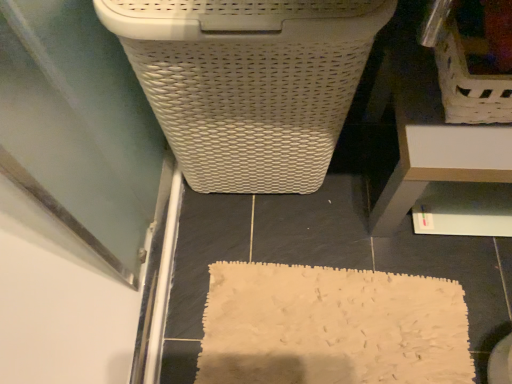
Question: Is white wicker laundry basket at upper right bigger or smaller than white plastic drawer at lower right?

Choices:
 (A) small
 (B) big

Answer: (A)

Question: From the image's perspective, is white wicker laundry basket at upper right located above or below white plastic drawer at lower right?

Choices:
 (A) below
 (B) above

Answer: (B)

Question: Considering the real-world distances, which object is closest to the white woven laundry basket at upper center?

Choices:
 (A) white plastic drawer at lower right
 (B) white wicker laundry basket at upper right
 (C) transparent glass screen door at lower left

Answer: (C)

Question: Which object is the closest to the white woven laundry basket at upper center?

Choices:
 (A) transparent glass screen door at lower left
 (B) white wicker laundry basket at upper right
 (C) white plastic drawer at lower right

Answer: (A)